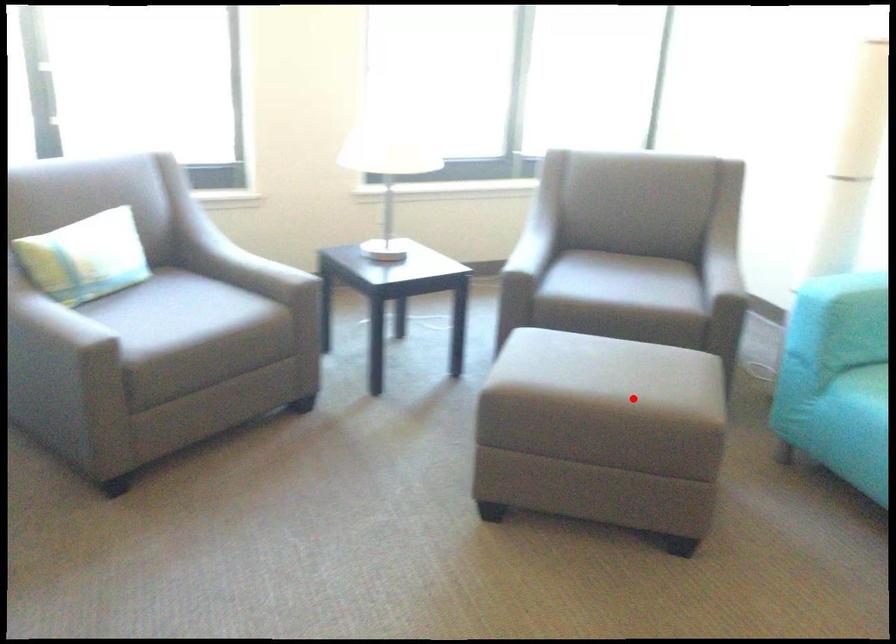
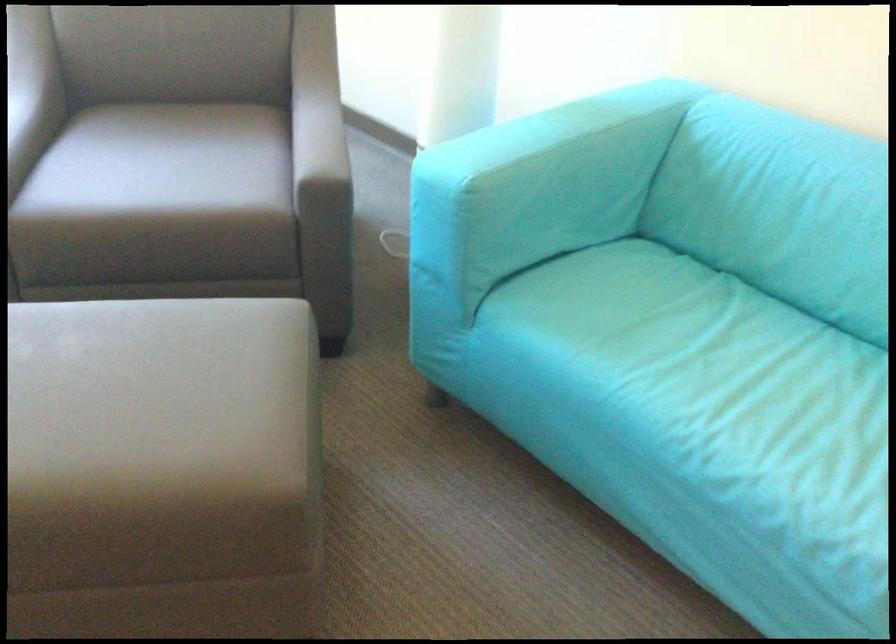
Question: I am providing you with two images of the same scene from different viewpoints. Given a red point in image1, look at the same physical point in image2. Is it:

Choices:
 (A) Closer to the viewpoint
 (B) Farther from the viewpoint

Answer: (A)